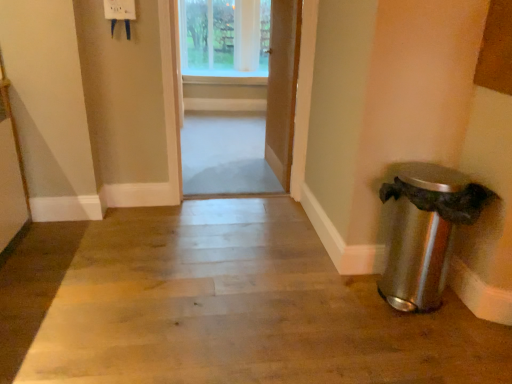
Where is `free space in front of satin silver trash can at lower right`? Image resolution: width=512 pixels, height=384 pixels. free space in front of satin silver trash can at lower right is located at coordinates (434, 348).